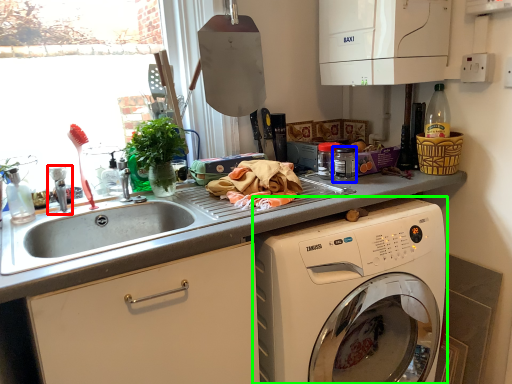
Question: Estimate the real-world distances between objects in this image. Which object is closer to faucet (highlighted by a red box), appliance (highlighted by a blue box) or washing machine (highlighted by a green box)?

Choices:
 (A) appliance
 (B) washing machine

Answer: (A)